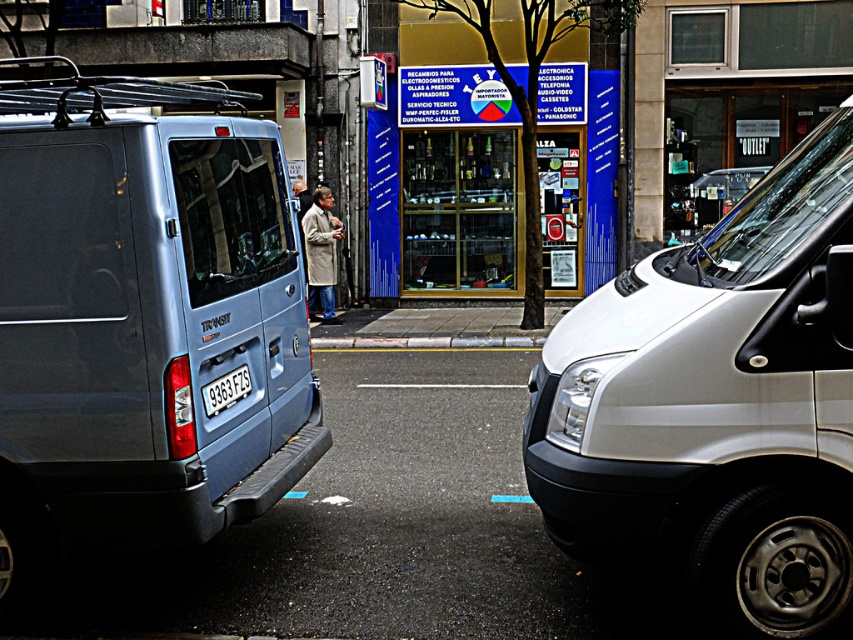
Is point (321, 285) farther from viewer compared to point (422, 340)?

Yes, point (321, 285) is farther from viewer.

Does light brown coat at center have a lesser width compared to gray concrete curb at center?

A: Correct, light brown coat at center's width is less than gray concrete curb at center's.

Find the location of `light brown coat at center`. light brown coat at center is located at coordinates (321, 252).

Can you confirm if gray concrete curb at center is positioned above light brown leather jacket at center?

Actually, gray concrete curb at center is below light brown leather jacket at center.

Does gray concrete curb at center have a lesser height compared to light brown leather jacket at center?

Correct, gray concrete curb at center is not as tall as light brown leather jacket at center.

Measure the distance between gray concrete curb at center and camera.

The distance of gray concrete curb at center from camera is 12.41 meters.

I want to click on gray concrete curb at center, so click(426, 340).

Is light brown coat at center thinner than white plastic license plate at center?

Incorrect, light brown coat at center's width is not less than white plastic license plate at center's.

How much distance is there between light brown coat at center and white plastic license plate at center?

light brown coat at center and white plastic license plate at center are 9.91 meters apart.

Identify the location of light brown coat at center. This screenshot has width=853, height=640. (321, 252).